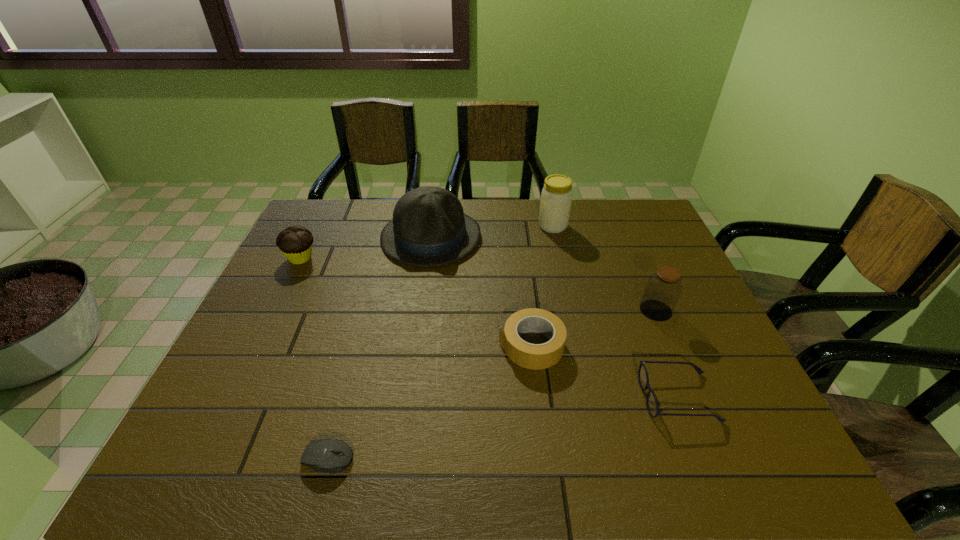
Find the location of a particular element. free space at the left edge of the desktop is located at coordinates (324, 248).

Locate an element on the screen. This screenshot has width=960, height=540. free region at the right edge of the desktop is located at coordinates (636, 260).

At what (x,y) coordinates should I click in order to perform the action: click on vacant space at the far left corner. Please return your answer as a coordinate pair (x, y). The image size is (960, 540). Looking at the image, I should click on (326, 227).

Identify the location of blank space at the far right corner of the desktop. The height and width of the screenshot is (540, 960). (626, 211).

Image resolution: width=960 pixels, height=540 pixels. I want to click on free space at the near right corner, so click(x=782, y=455).

You are a GUI agent. You are given a task and a screenshot of the screen. Output one action in this format:
    pyautogui.click(x=<x>, y=<y>)
    Task: Click on the free area in between the spectacles and the leftmost object
    This screenshot has width=960, height=540.
    Given the screenshot: What is the action you would take?
    pyautogui.click(x=490, y=328)

The width and height of the screenshot is (960, 540). In order to click on free spot between the spectacles and the left jar in this screenshot , I will do `click(615, 312)`.

Identify the location of vacant area that lies between the taller jar and the right jar. The height and width of the screenshot is (540, 960). (605, 268).

Where is `vacant area that lies between the nearer jar and the leftmost object`? The width and height of the screenshot is (960, 540). vacant area that lies between the nearer jar and the leftmost object is located at coordinates pyautogui.click(x=478, y=284).

In order to click on vacant area that lies between the muffin and the computer equipment in this screenshot , I will do `click(315, 358)`.